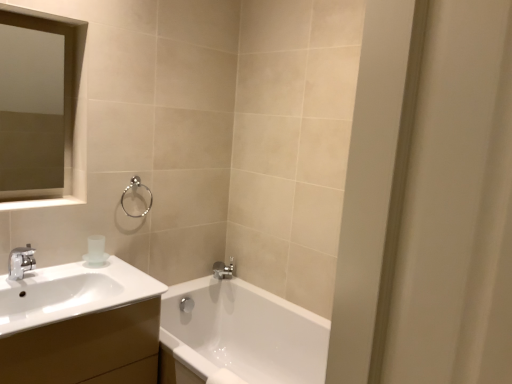
At what (x,y) coordinates should I click in order to perform the action: click on free space to the right of matte glass medicine cabinet at upper left. Please return your answer as a coordinate pair (x, y). Looking at the image, I should click on (56, 198).